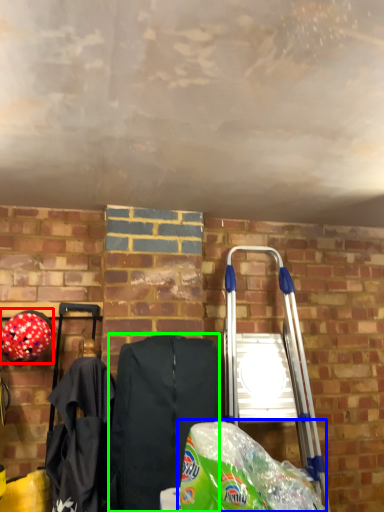
Question: Which object is the farthest from helmet (highlighted by a red box)? Choose among these: grocery bag (highlighted by a blue box) or folding chair (highlighted by a green box).

Choices:
 (A) grocery bag
 (B) folding chair

Answer: (A)